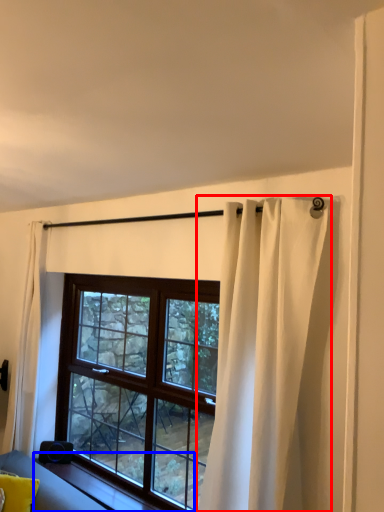
Question: Which object is further to the camera taking this photo, curtain (highlighted by a red box) or window sill (highlighted by a blue box)?

Choices:
 (A) curtain
 (B) window sill

Answer: (B)